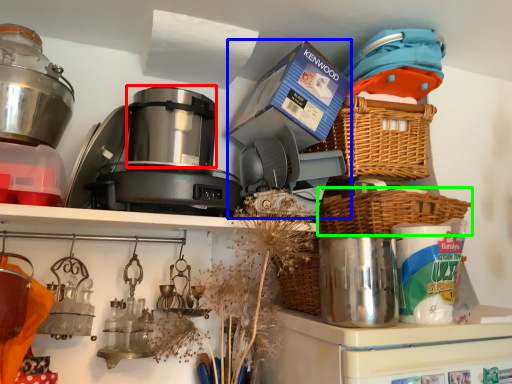
Question: Which object is the farthest from appliance (highlighted by a red box)? Choose among these: coffee machine (highlighted by a blue box) or basket (highlighted by a green box).

Choices:
 (A) coffee machine
 (B) basket

Answer: (B)